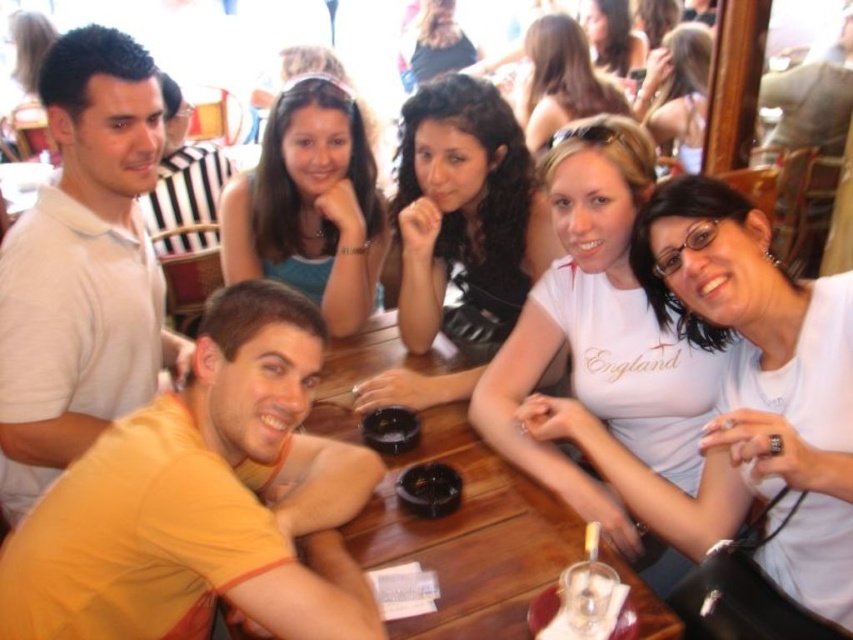
Who is positioned more to the right, orange cotton shirt at lower left or wooden table at center?

wooden table at center is more to the right.

Is orange cotton shirt at lower left positioned in front of wooden table at center?

Yes, it is in front of wooden table at center.

Does point (328, 632) come closer to viewer compared to point (488, 621)?

Yes, point (328, 632) is in front of point (488, 621).

Find the location of a particular element. The image size is (853, 640). orange cotton shirt at lower left is located at coordinates (202, 499).

Which is below, wooden table at center or curly hair at center?

wooden table at center

Is wooden table at center shorter than curly hair at center?

Correct, wooden table at center is not as tall as curly hair at center.

Locate an element on the screen. wooden table at center is located at coordinates (469, 536).

In the scene shown: Can you confirm if white matte shirt at left is positioned above matte black shirt at upper center?

No.

Is white matte shirt at left positioned in front of matte black shirt at upper center?

Yes, white matte shirt at left is closer to the viewer.

The width and height of the screenshot is (853, 640). Find the location of `white matte shirt at left`. white matte shirt at left is located at coordinates (82, 268).